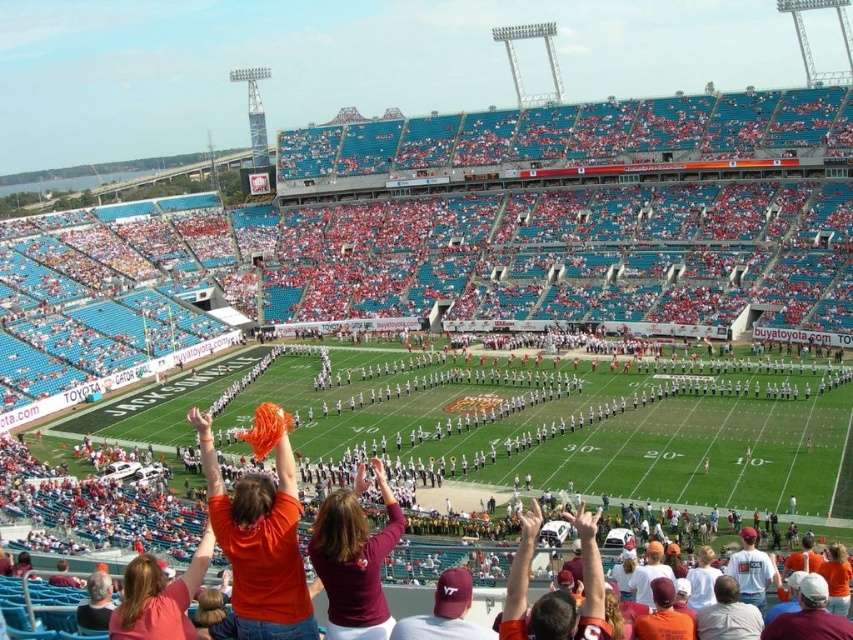
You are a photographer at the stadium and need to capture both the orange fabric at center and the maroon jersey at center in a single shot. Which object should you focus on first to ensure both are in frame?

The orange fabric at center is much taller than the maroon jersey at center, so you should focus on the orange fabric at center first to ensure both are in frame.

You are a photographer positioned at the front row of the stadium. You want to take a photo of the maroon jersey at center without the orange fabric at center blocking it. What should you do?

The maroon jersey at center is behind the orange fabric at center, so you should move to a position where you can see behind the orange fabric at center to capture the maroon jersey at center clearly.

You are a photographer at the stadium and want to capture a photo that includes both the orange fabric at center and the maroon jersey at center. Which object should you focus on first if you want to ensure both are in the frame?

The orange fabric at center is located above the maroon jersey at center, so you should focus on the maroon jersey at center first to ensure both are in the frame.